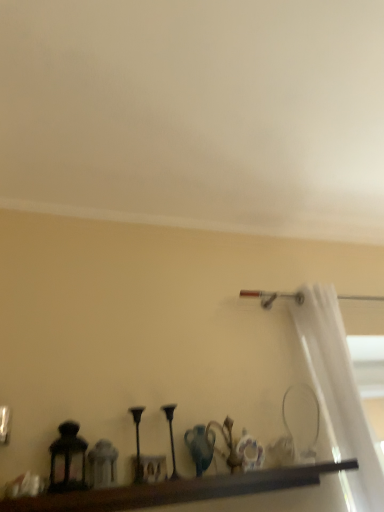
Question: Is white sheer curtain at right far away from brown wooden shelf at lower center?

Choices:
 (A) yes
 (B) no

Answer: (B)

Question: Is white sheer curtain at right at the right side of brown wooden shelf at lower center?

Choices:
 (A) no
 (B) yes

Answer: (B)

Question: Would you say white sheer curtain at right contains brown wooden shelf at lower center?

Choices:
 (A) no
 (B) yes

Answer: (A)

Question: Does white sheer curtain at right come behind brown wooden shelf at lower center?

Choices:
 (A) yes
 (B) no

Answer: (A)

Question: Considering the relative sizes of white sheer curtain at right and brown wooden shelf at lower center in the image provided, is white sheer curtain at right bigger than brown wooden shelf at lower center?

Choices:
 (A) no
 (B) yes

Answer: (B)

Question: From the image's perspective, is white sheer curtain at right on top of brown wooden shelf at lower center?

Choices:
 (A) no
 (B) yes

Answer: (B)

Question: From a real-world perspective, is brown wooden shelf at lower center over white sheer curtain at right?

Choices:
 (A) yes
 (B) no

Answer: (B)

Question: Can you confirm if brown wooden shelf at lower center is taller than white sheer curtain at right?

Choices:
 (A) yes
 (B) no

Answer: (B)

Question: From a real-world perspective, is brown wooden shelf at lower center located beneath white sheer curtain at right?

Choices:
 (A) yes
 (B) no

Answer: (A)

Question: Is brown wooden shelf at lower center positioned far away from white sheer curtain at right?

Choices:
 (A) yes
 (B) no

Answer: (B)

Question: Is brown wooden shelf at lower center facing away from white sheer curtain at right?

Choices:
 (A) yes
 (B) no

Answer: (B)

Question: Is brown wooden shelf at lower center positioned before white sheer curtain at right?

Choices:
 (A) no
 (B) yes

Answer: (B)

Question: From a real-world perspective, is matte black lantern at left on top of brown wooden shelf at lower center?

Choices:
 (A) no
 (B) yes

Answer: (B)